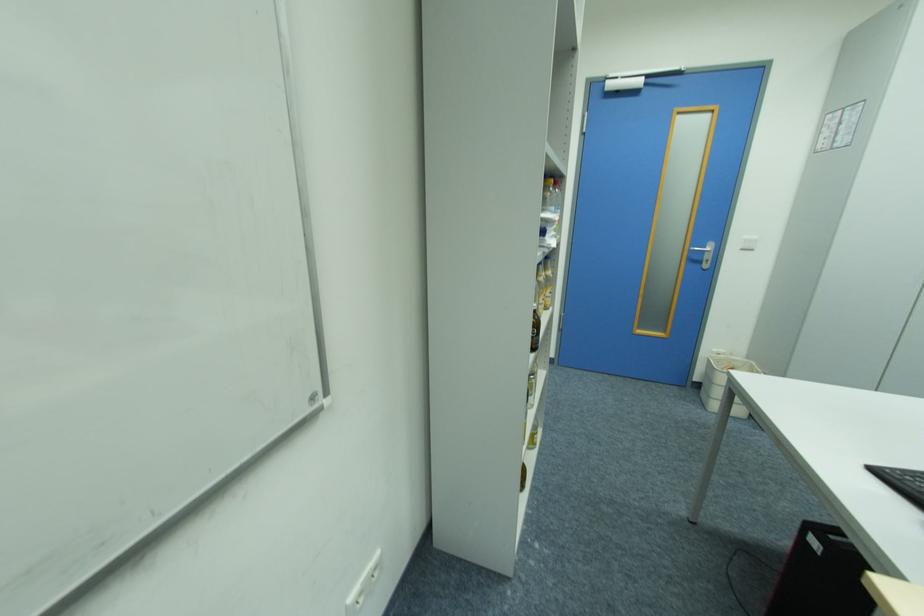
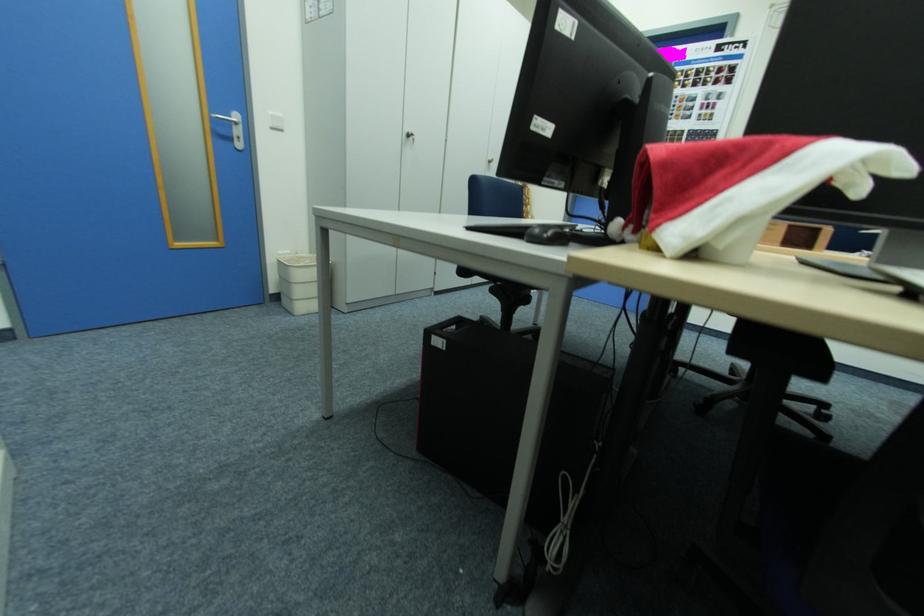
In the second image, find the point that corresponds to (699,251) in the first image.

(222, 119)